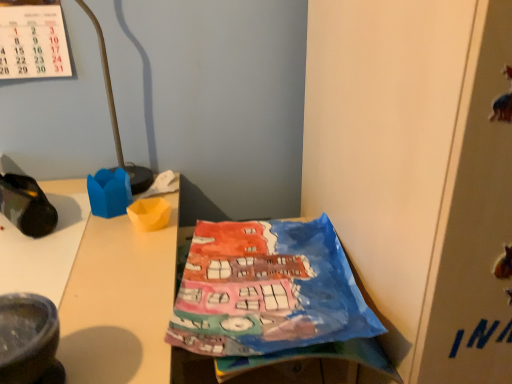
Question: Can you confirm if watercolor paper at center is smaller than camouflage fabric shoe at left?

Choices:
 (A) no
 (B) yes

Answer: (A)

Question: Is watercolor paper at center behind camouflage fabric shoe at left?

Choices:
 (A) yes
 (B) no

Answer: (B)

Question: Does watercolor paper at center have a greater height compared to camouflage fabric shoe at left?

Choices:
 (A) no
 (B) yes

Answer: (B)

Question: Does watercolor paper at center come in front of camouflage fabric shoe at left?

Choices:
 (A) no
 (B) yes

Answer: (B)

Question: Is watercolor paper at center not within camouflage fabric shoe at left?

Choices:
 (A) no
 (B) yes

Answer: (B)

Question: From the image's perspective, does watercolor paper at center appear lower than camouflage fabric shoe at left?

Choices:
 (A) no
 (B) yes

Answer: (B)

Question: Could you tell me if camouflage fabric shoe at left is facing watercolor paper at center?

Choices:
 (A) no
 (B) yes

Answer: (A)

Question: Is watercolor paper at center completely or partially inside camouflage fabric shoe at left?

Choices:
 (A) no
 (B) yes

Answer: (A)

Question: Considering the relative positions of camouflage fabric shoe at left and watercolor paper at center in the image provided, is camouflage fabric shoe at left to the right of watercolor paper at center from the viewer's perspective?

Choices:
 (A) yes
 (B) no

Answer: (B)

Question: Are camouflage fabric shoe at left and watercolor paper at center located far from each other?

Choices:
 (A) no
 (B) yes

Answer: (A)

Question: Does camouflage fabric shoe at left have a lesser height compared to watercolor paper at center?

Choices:
 (A) no
 (B) yes

Answer: (B)

Question: Can you confirm if camouflage fabric shoe at left is thinner than watercolor paper at center?

Choices:
 (A) no
 (B) yes

Answer: (B)

Question: Considering the relative sizes of metallic gold lamp at upper left and watercolor paper at center in the image provided, is metallic gold lamp at upper left wider than watercolor paper at center?

Choices:
 (A) no
 (B) yes

Answer: (A)